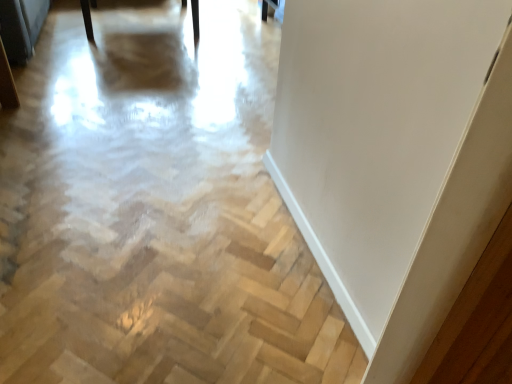
Measure the distance between point (x=197, y=28) and camera.

Point (x=197, y=28) is 3.52 meters away from camera.

The image size is (512, 384). What do you see at coordinates (88, 17) in the screenshot?
I see `matte wood chair at upper center` at bounding box center [88, 17].

Find the location of a particular element. matte wood chair at upper center is located at coordinates (88, 17).

Identify the location of matte wood chair at upper center. (88, 17).